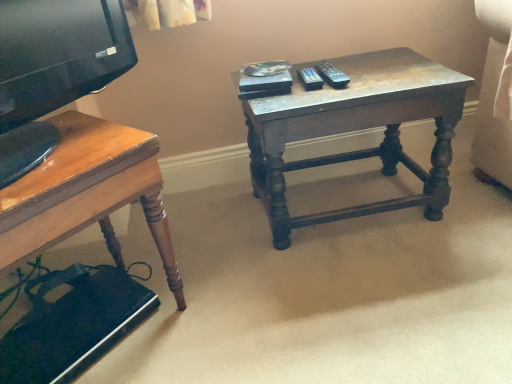
Identify the location of vacant space behind wooden desk at lower left. The image size is (512, 384). (137, 243).